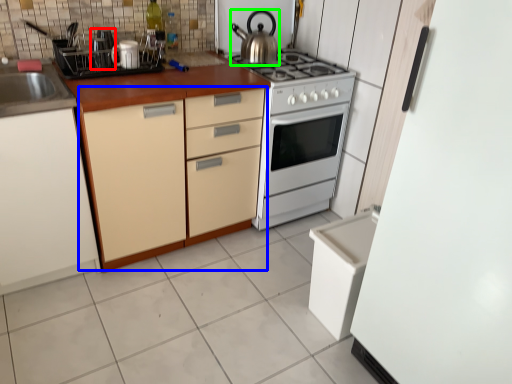
Question: Which is nearer to the appliance (highlighted by a red box)? cabinetry (highlighted by a blue box) or kitchen appliance (highlighted by a green box).

Choices:
 (A) cabinetry
 (B) kitchen appliance

Answer: (A)